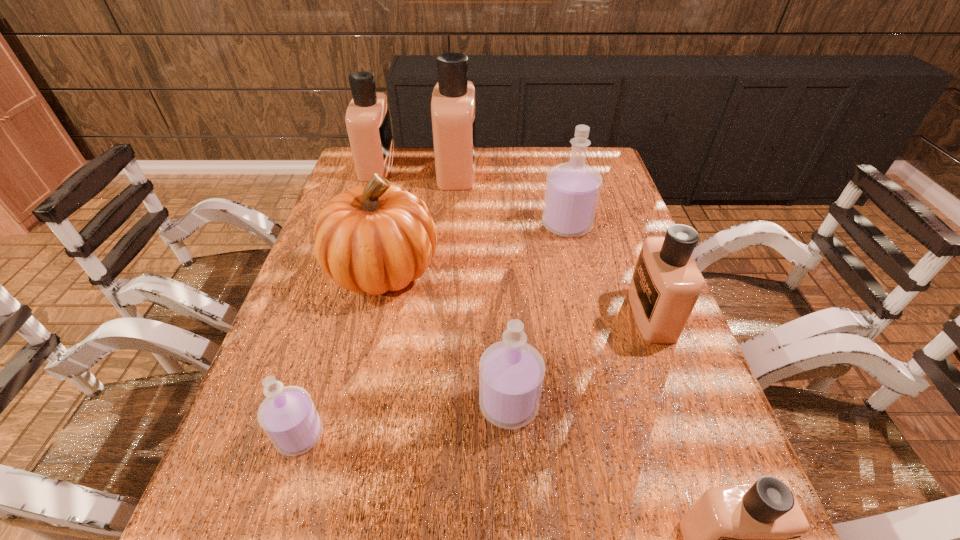
Image resolution: width=960 pixels, height=540 pixels. Find the location of `vacant space that is in between the biggest purple perfume and the leftmost purple perfume`. vacant space that is in between the biggest purple perfume and the leftmost purple perfume is located at coordinates (433, 330).

Locate an element on the screen. vacant area that lies between the second beige perfume from left to right and the second smallest purple perfume is located at coordinates (483, 287).

The height and width of the screenshot is (540, 960). Find the location of `free space between the orange pumpkin and the fifth object from left to right`. free space between the orange pumpkin and the fifth object from left to right is located at coordinates (445, 336).

You are a GUI agent. You are given a task and a screenshot of the screen. Output one action in this format:
    pyautogui.click(x=<x>, y=<y>)
    Task: Click on the object that stands as the fourth closest to the fifth nearest perfume
    The height and width of the screenshot is (540, 960).
    Given the screenshot: What is the action you would take?
    pyautogui.click(x=511, y=372)

Select which object appears as the seventh closest to the nearest beige perfume. Please provide its 2D coordinates. Your answer should be formatted as a tuple, i.e. [(x, y)], where the tuple contains the x and y coordinates of a point satisfying the conditions above.

[(367, 118)]

I want to click on perfume object that ranks as the fifth closest to the third perfume from left to right, so click(287, 415).

Find the location of a particular element. the fifth closest perfume to the tallest perfume is located at coordinates (287, 415).

I want to click on beige perfume that is the third closest to the rightmost purple perfume, so click(x=367, y=118).

Locate an element on the screen. The image size is (960, 540). the closest beige perfume to the second smallest beige perfume is located at coordinates (737, 539).

The height and width of the screenshot is (540, 960). I want to click on purple perfume that is the second closest to the fifth nearest perfume, so click(287, 415).